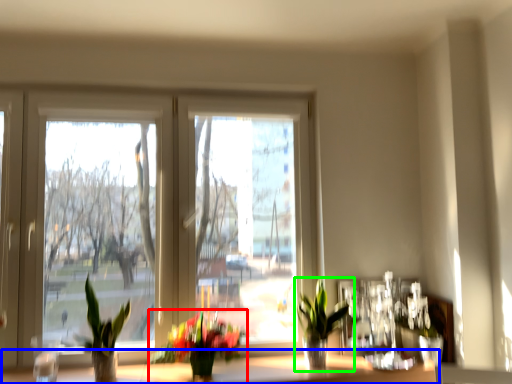
Question: Based on their relative distances, which object is farther from houseplant (highlighted by a red box)? Choose from window sill (highlighted by a blue box) and houseplant (highlighted by a green box).

Choices:
 (A) window sill
 (B) houseplant

Answer: (B)